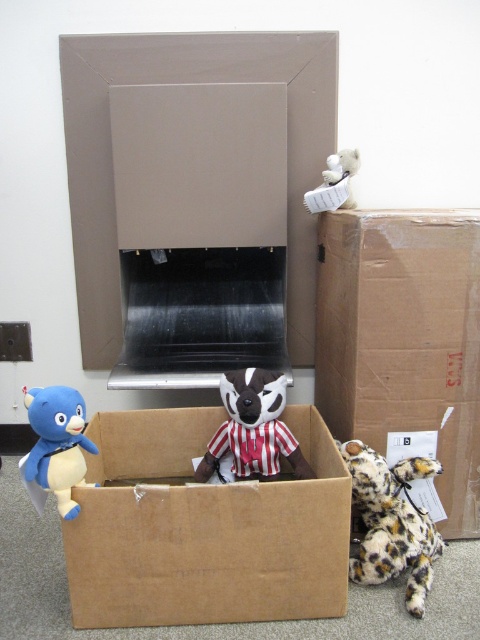
Does leopard print plush at lower right lie in front of striped plush toy at center?

Yes, it is.

Does leopard print plush at lower right appear on the right side of striped plush toy at center?

Correct, you'll find leopard print plush at lower right to the right of striped plush toy at center.

You are a GUI agent. You are given a task and a screenshot of the screen. Output one action in this format:
    pyautogui.click(x=<x>, y=<y>)
    Task: Click on the leopard print plush at lower right
    This screenshot has width=480, height=640.
    Given the screenshot: What is the action you would take?
    pyautogui.click(x=392, y=522)

Is brown cardboard box at lower right to the right of matte cardboard box at center from the viewer's perspective?

Correct, you'll find brown cardboard box at lower right to the right of matte cardboard box at center.

Is brown cardboard box at lower right shorter than matte cardboard box at center?

Yes.

The image size is (480, 640). What do you see at coordinates (404, 339) in the screenshot?
I see `brown cardboard box at lower right` at bounding box center [404, 339].

In order to click on brown cardboard box at lower right in this screenshot , I will do `click(404, 339)`.

Is point (87, 428) closer to camera compared to point (417, 538)?

No, (87, 428) is further to viewer.

Which is below, brown cardboard box at center or leopard print plush at lower right?

leopard print plush at lower right is lower down.

Looking at this image, measure the distance between brown cardboard box at center and camera.

Answer: 1.27 meters

Image resolution: width=480 pixels, height=640 pixels. In order to click on brown cardboard box at center in this screenshot , I will do `click(203, 529)`.